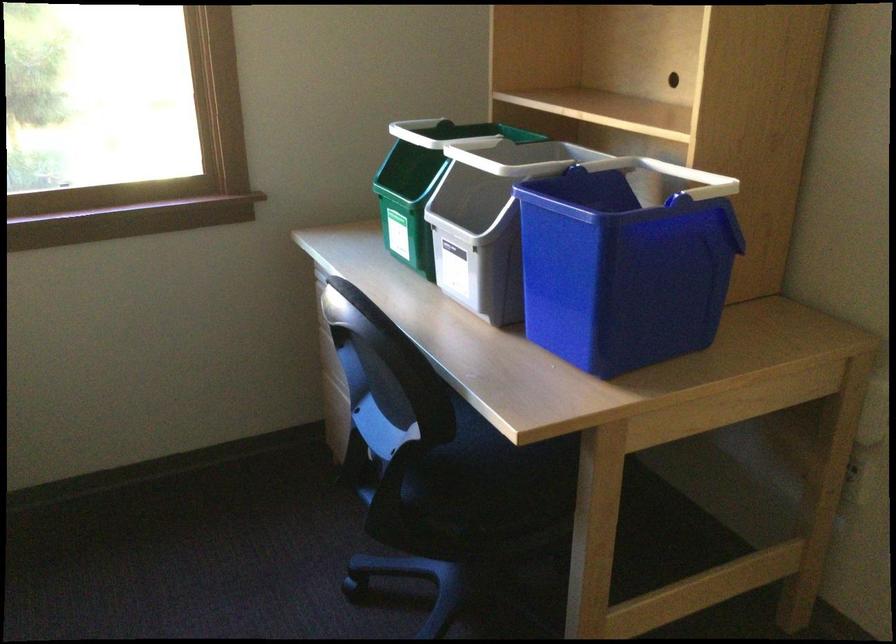
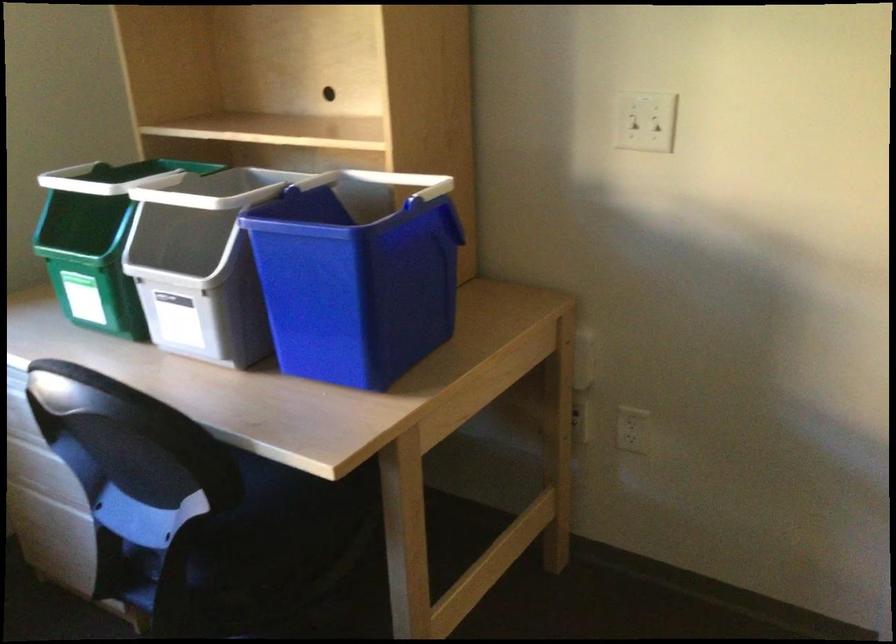
What movement of the cameraman would produce the second image?

The cameraman walked toward left, forward.